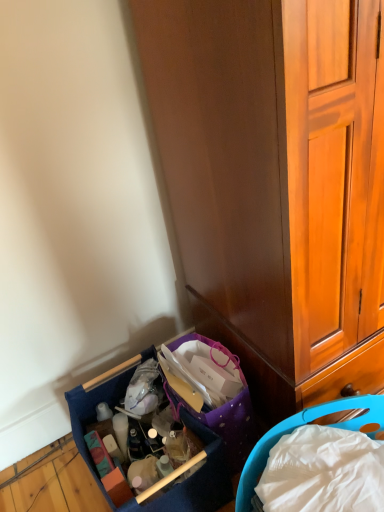
I want to click on wooden cabinet at lower right, so click(x=276, y=182).

Find the location of `blue plastic picnic basket at lower right, which is counted as the 1th picnic basket, starting from the right`. blue plastic picnic basket at lower right, which is counted as the 1th picnic basket, starting from the right is located at coordinates (301, 425).

What do you see at coordinates (198, 478) in the screenshot? The height and width of the screenshot is (512, 384). I see `blue fabric basket at lower left, the second picnic basket positioned from the right` at bounding box center [198, 478].

Locate an element on the screen. The width and height of the screenshot is (384, 512). wooden cabinet at lower right is located at coordinates (276, 182).

Does blue fabric basket at lower left, the 1th picnic basket positioned from the left, have a greater height compared to wooden cabinet at lower right?

No, blue fabric basket at lower left, the 1th picnic basket positioned from the left, is not taller than wooden cabinet at lower right.

From the image's perspective, which object appears higher, blue fabric basket at lower left, the 1th picnic basket positioned from the left, or wooden cabinet at lower right?

wooden cabinet at lower right is shown above in the image.

Is blue fabric basket at lower left, the 1th picnic basket positioned from the left, far away from wooden cabinet at lower right?

They are positioned close to each other.

Which of these two, blue fabric basket at lower left, the second picnic basket positioned from the right, or wooden cabinet at lower right, is thinner?

blue fabric basket at lower left, the second picnic basket positioned from the right.

Considering the relative positions of blue plastic picnic basket at lower right, which is counted as the second picnic basket, starting from the left, and blue fabric basket at lower left, the second picnic basket positioned from the right, in the image provided, is blue plastic picnic basket at lower right, which is counted as the second picnic basket, starting from the left, to the left or to the right of blue fabric basket at lower left, the second picnic basket positioned from the right,?

blue plastic picnic basket at lower right, which is counted as the second picnic basket, starting from the left, is to the right of blue fabric basket at lower left, the second picnic basket positioned from the right.

Locate an element on the screen. picnic basket that is in front of the blue fabric basket at lower left, the 1th picnic basket positioned from the left is located at coordinates (301, 425).

Considering the relative sizes of blue plastic picnic basket at lower right, which is counted as the 1th picnic basket, starting from the right, and blue fabric basket at lower left, the second picnic basket positioned from the right, in the image provided, is blue plastic picnic basket at lower right, which is counted as the 1th picnic basket, starting from the right, taller than blue fabric basket at lower left, the second picnic basket positioned from the right,?

No.

Is blue plastic picnic basket at lower right, which is counted as the 1th picnic basket, starting from the right, positioned with its back to blue fabric basket at lower left, the 1th picnic basket positioned from the left?

Yes, blue plastic picnic basket at lower right, which is counted as the 1th picnic basket, starting from the right, is positioned with its back facing blue fabric basket at lower left, the 1th picnic basket positioned from the left.

Could you tell me if wooden cabinet at lower right is turned towards blue fabric basket at lower left, the 1th picnic basket positioned from the left?

No, wooden cabinet at lower right is not aimed at blue fabric basket at lower left, the 1th picnic basket positioned from the left.

Can we say wooden cabinet at lower right lies outside blue fabric basket at lower left, the 1th picnic basket positioned from the left?

Yes, wooden cabinet at lower right is outside of blue fabric basket at lower left, the 1th picnic basket positioned from the left.

Is wooden cabinet at lower right wider than blue fabric basket at lower left, the second picnic basket positioned from the right?

Yes, wooden cabinet at lower right is wider than blue fabric basket at lower left, the second picnic basket positioned from the right.

Choose the correct answer: Is wooden cabinet at lower right inside blue plastic picnic basket at lower right, which is counted as the second picnic basket, starting from the left, or outside it?

wooden cabinet at lower right is outside blue plastic picnic basket at lower right, which is counted as the second picnic basket, starting from the left.

Where is `cabinetry located on the right of blue plastic picnic basket at lower right, which is counted as the 1th picnic basket, starting from the right`? The image size is (384, 512). cabinetry located on the right of blue plastic picnic basket at lower right, which is counted as the 1th picnic basket, starting from the right is located at coordinates (276, 182).

Is blue plastic picnic basket at lower right, which is counted as the second picnic basket, starting from the left, at the back of wooden cabinet at lower right?

wooden cabinet at lower right is not turned away from blue plastic picnic basket at lower right, which is counted as the second picnic basket, starting from the left.

I want to click on cabinetry on the right side of blue plastic picnic basket at lower right, which is counted as the second picnic basket, starting from the left, so click(x=276, y=182).

Is blue plastic picnic basket at lower right, which is counted as the 1th picnic basket, starting from the right, facing away from wooden cabinet at lower right?

No, blue plastic picnic basket at lower right, which is counted as the 1th picnic basket, starting from the right,'s orientation is not away from wooden cabinet at lower right.

Looking at this image, from a real-world perspective, between blue plastic picnic basket at lower right, which is counted as the second picnic basket, starting from the left, and wooden cabinet at lower right, who is vertically higher?

wooden cabinet at lower right is physically above.

Based on the photo, is blue plastic picnic basket at lower right, which is counted as the second picnic basket, starting from the left, closer to the viewer compared to wooden cabinet at lower right?

That is False.

Based on the photo, from the image's perspective, which object appears higher, blue fabric basket at lower left, the second picnic basket positioned from the right, or blue plastic picnic basket at lower right, which is counted as the second picnic basket, starting from the left?

blue fabric basket at lower left, the second picnic basket positioned from the right, from the image's perspective.

Looking at this image, is blue fabric basket at lower left, the second picnic basket positioned from the right, beside blue plastic picnic basket at lower right, which is counted as the 1th picnic basket, starting from the right?

No, blue fabric basket at lower left, the second picnic basket positioned from the right, is not next to blue plastic picnic basket at lower right, which is counted as the 1th picnic basket, starting from the right.

In the scene shown: Does blue fabric basket at lower left, the second picnic basket positioned from the right, have a greater width compared to blue plastic picnic basket at lower right, which is counted as the 1th picnic basket, starting from the right?

Yes.

Identify the location of cabinetry in front of the blue fabric basket at lower left, the second picnic basket positioned from the right. (276, 182).

Locate an element on the screen. picnic basket beneath the blue fabric basket at lower left, the 1th picnic basket positioned from the left (from a real-world perspective) is located at coordinates (x=301, y=425).

Which object lies further to the anchor point wooden cabinet at lower right, blue fabric basket at lower left, the 1th picnic basket positioned from the left, or blue plastic picnic basket at lower right, which is counted as the second picnic basket, starting from the left?

blue fabric basket at lower left, the 1th picnic basket positioned from the left, lies further to wooden cabinet at lower right than the other object.

When comparing their distances from wooden cabinet at lower right, does blue plastic picnic basket at lower right, which is counted as the second picnic basket, starting from the left, or blue fabric basket at lower left, the 1th picnic basket positioned from the left, seem further?

blue fabric basket at lower left, the 1th picnic basket positioned from the left, is positioned further to the anchor wooden cabinet at lower right.

Based on their spatial positions, is blue plastic picnic basket at lower right, which is counted as the 1th picnic basket, starting from the right, or wooden cabinet at lower right closer to blue fabric basket at lower left, the 1th picnic basket positioned from the left?

blue plastic picnic basket at lower right, which is counted as the 1th picnic basket, starting from the right, is closer to blue fabric basket at lower left, the 1th picnic basket positioned from the left.

Which object lies further to the anchor point blue fabric basket at lower left, the second picnic basket positioned from the right, wooden cabinet at lower right or blue plastic picnic basket at lower right, which is counted as the second picnic basket, starting from the left?

wooden cabinet at lower right is positioned further to the anchor blue fabric basket at lower left, the second picnic basket positioned from the right.

Estimate the real-world distances between objects in this image. Which object is further from blue plastic picnic basket at lower right, which is counted as the 1th picnic basket, starting from the right, wooden cabinet at lower right or blue fabric basket at lower left, the second picnic basket positioned from the right?

Based on the image, wooden cabinet at lower right appears to be further to blue plastic picnic basket at lower right, which is counted as the 1th picnic basket, starting from the right.

Considering their positions, is blue fabric basket at lower left, the second picnic basket positioned from the right, positioned further to blue plastic picnic basket at lower right, which is counted as the second picnic basket, starting from the left, than wooden cabinet at lower right?

wooden cabinet at lower right is further to blue plastic picnic basket at lower right, which is counted as the second picnic basket, starting from the left.

The image size is (384, 512). In order to click on picnic basket between wooden cabinet at lower right and blue plastic picnic basket at lower right, which is counted as the 1th picnic basket, starting from the right, in the vertical direction in this screenshot , I will do `click(198, 478)`.